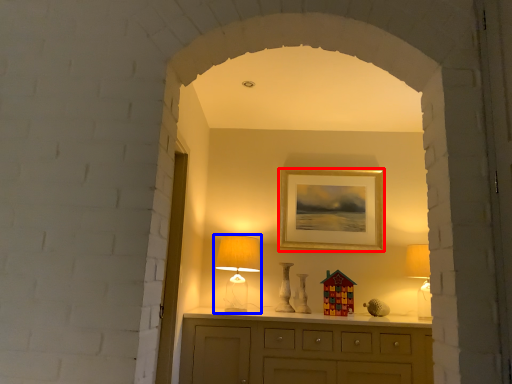
Question: Which point is further to the camera, picture frame (highlighted by a red box) or table lamp (highlighted by a blue box)?

Choices:
 (A) picture frame
 (B) table lamp

Answer: (A)